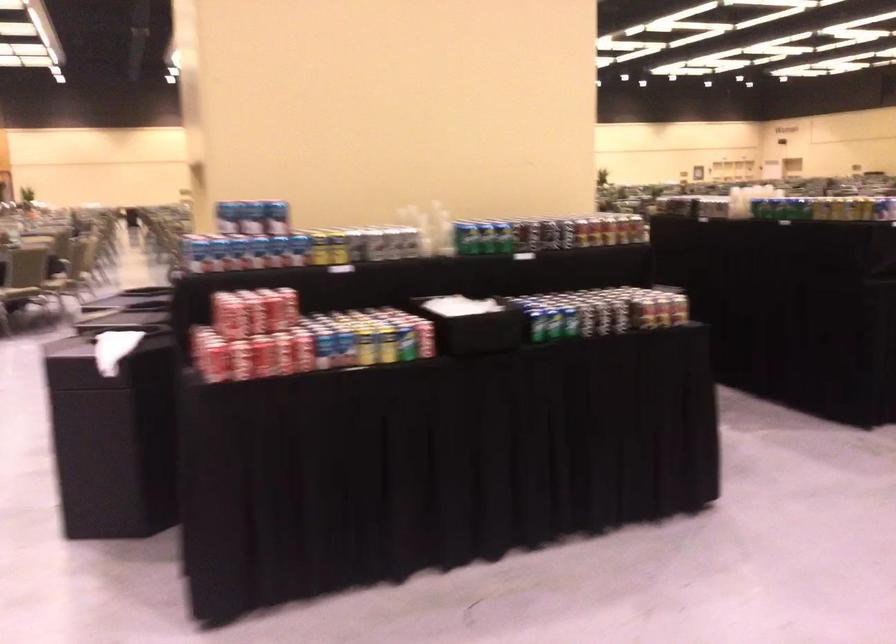
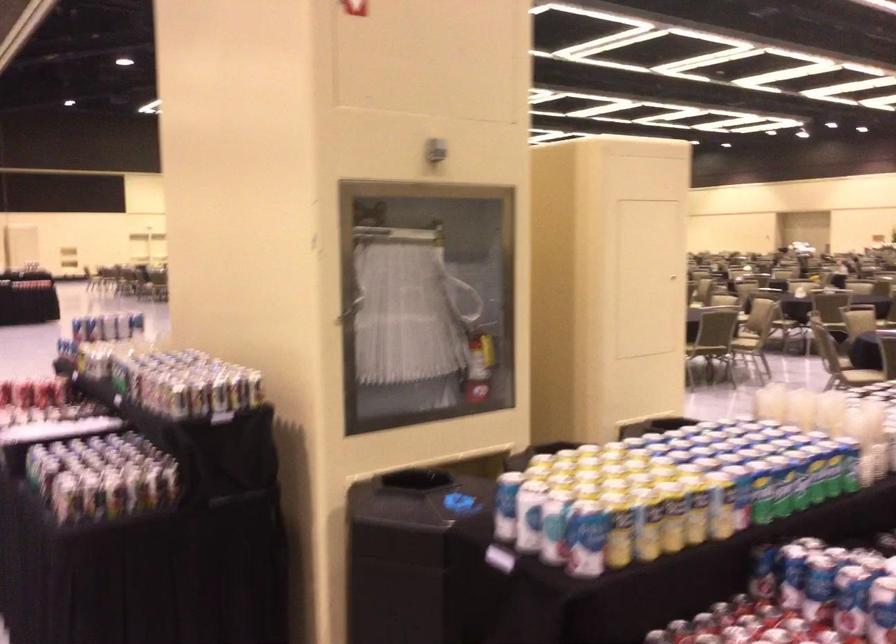
The point at (584, 149) is marked in the first image. Where is the corresponding point in the second image?

(349, 310)